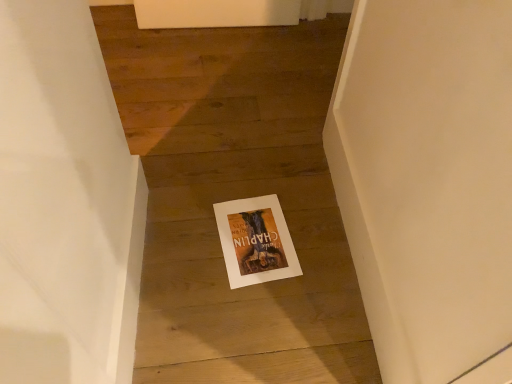
The height and width of the screenshot is (384, 512). In order to click on vacant space underneath white paper at center (from a real-world perspective) in this screenshot , I will do `click(253, 235)`.